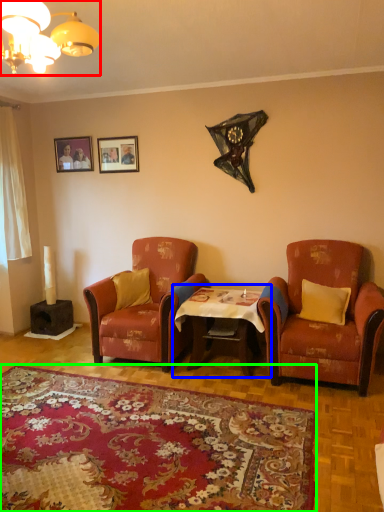
Question: Which object is the closest to the lamp (highlighted by a red box)? Choose among these: table (highlighted by a blue box) or plain (highlighted by a green box).

Choices:
 (A) table
 (B) plain

Answer: (B)